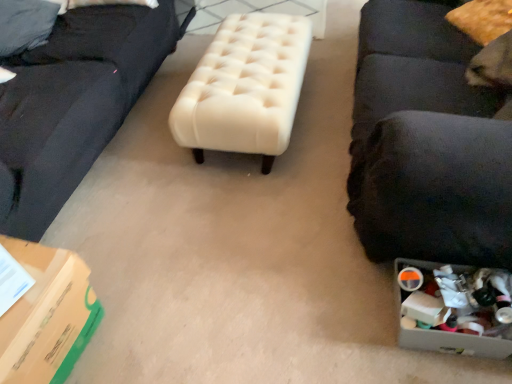
Question: Considering the positions of plastic container at lower right and fuzzy yellow pillow at upper right in the image, is plastic container at lower right bigger or smaller than fuzzy yellow pillow at upper right?

Choices:
 (A) small
 (B) big

Answer: (A)

Question: Is plastic container at lower right in front of or behind fuzzy yellow pillow at upper right in the image?

Choices:
 (A) behind
 (B) front

Answer: (B)

Question: Which of these objects is positioned farthest from the black fabric studio couch at right?

Choices:
 (A) green cardboard box at lower left
 (B) fuzzy yellow pillow at upper right
 (C) plastic container at lower right
 (D) creamy velvet ottoman at center

Answer: (A)

Question: Estimate the real-world distances between objects in this image. Which object is farther from the plastic container at lower right?

Choices:
 (A) creamy velvet ottoman at center
 (B) black fabric studio couch at right
 (C) fuzzy yellow pillow at upper right
 (D) green cardboard box at lower left

Answer: (C)